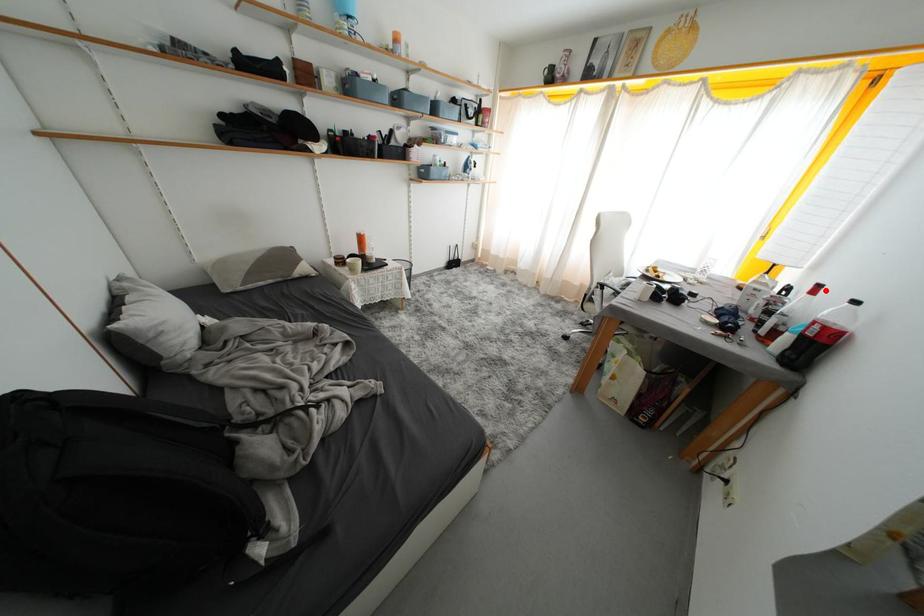
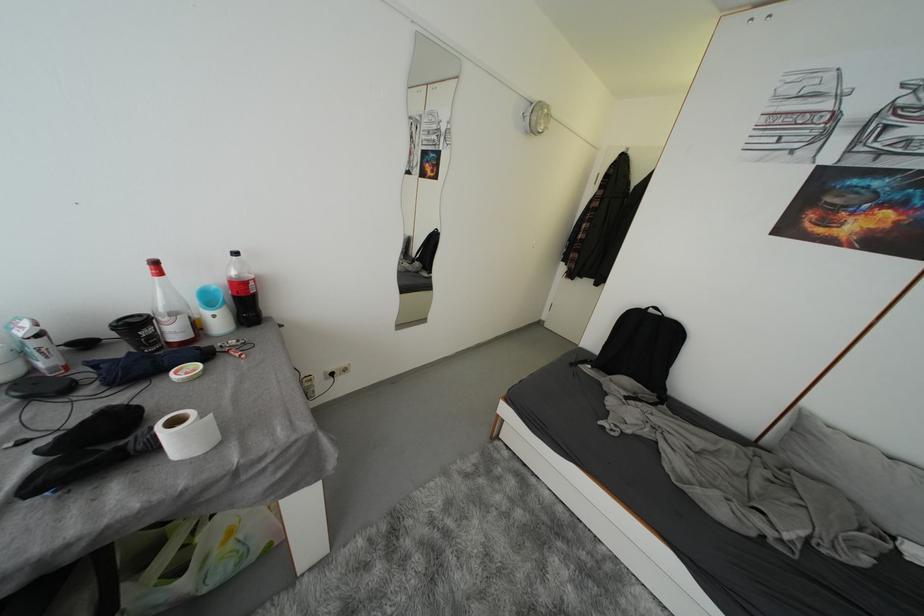
Question: I am providing you with two images of the same scene from different viewpoints. A red point is marked on the first image. Can you still see the location of the red point in image 2?

Choices:
 (A) Yes
 (B) No

Answer: (A)